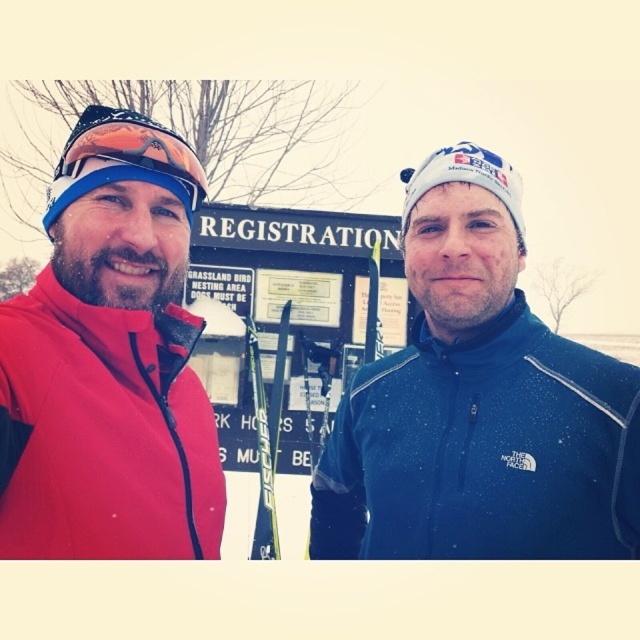
You are organizing a ski event and need to determine which jacket to choose for the participants based on visibility. Given that the blue fleece jacket at center and the matte red jacket at left are options, which one would be more visible against the snowy background?

The matte red jacket at left would be more visible against the snowy background because red contrasts more with white snow than blue does.